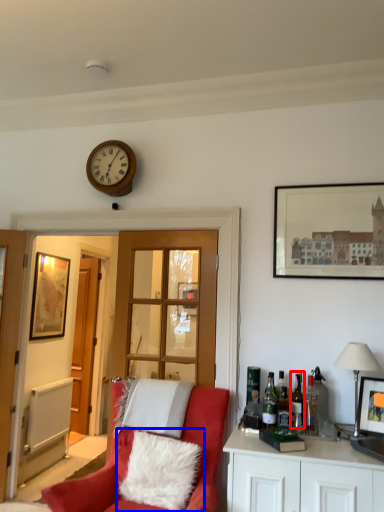
Question: Among these objects, which one is nearest to the camera, wine bottle (highlighted by a red box) or pillow (highlighted by a blue box)?

Choices:
 (A) wine bottle
 (B) pillow

Answer: (B)